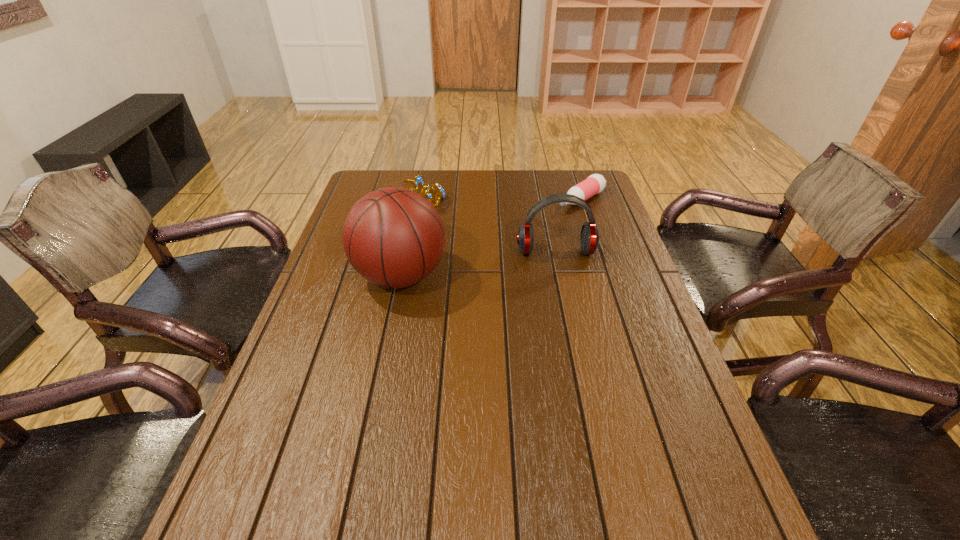
This screenshot has width=960, height=540. What are the coordinates of `free space located with the cap open on the bottle` in the screenshot? It's located at (502, 250).

Locate an element on the screen. vacant space located 0.180m with the cap open on the bottle is located at coordinates (532, 231).

Locate an element on the screen. The height and width of the screenshot is (540, 960). tiara that is at the far edge is located at coordinates (418, 181).

In order to click on bottle that is at the far edge in this screenshot , I will do `click(595, 183)`.

This screenshot has width=960, height=540. Identify the location of basketball at the left edge. (393, 237).

At what (x,y) coordinates should I click in order to perform the action: click on tiara that is positioned at the left edge. Please return your answer as a coordinate pair (x, y). This screenshot has height=540, width=960. Looking at the image, I should click on (418, 181).

Where is `earphone positioned at the right edge`? The image size is (960, 540). earphone positioned at the right edge is located at coordinates (589, 238).

Locate an element on the screen. The image size is (960, 540). bottle present at the right edge is located at coordinates 595,183.

Identify the location of object located at the far left corner. This screenshot has width=960, height=540. (418, 181).

Where is `object that is at the far right corner`? object that is at the far right corner is located at coordinates (595, 183).